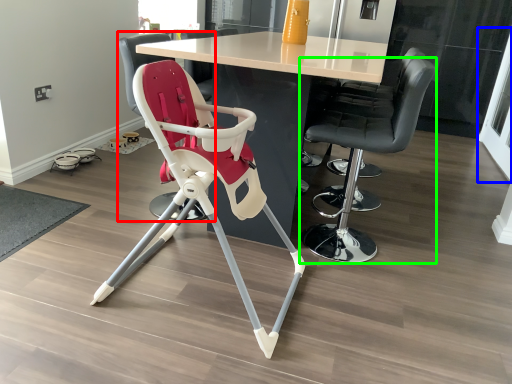
Question: Estimate the real-world distances between objects in this image. Which object is closer to chair (highlighted by a red box), screen door (highlighted by a blue box) or chair (highlighted by a green box)?

Choices:
 (A) screen door
 (B) chair

Answer: (B)